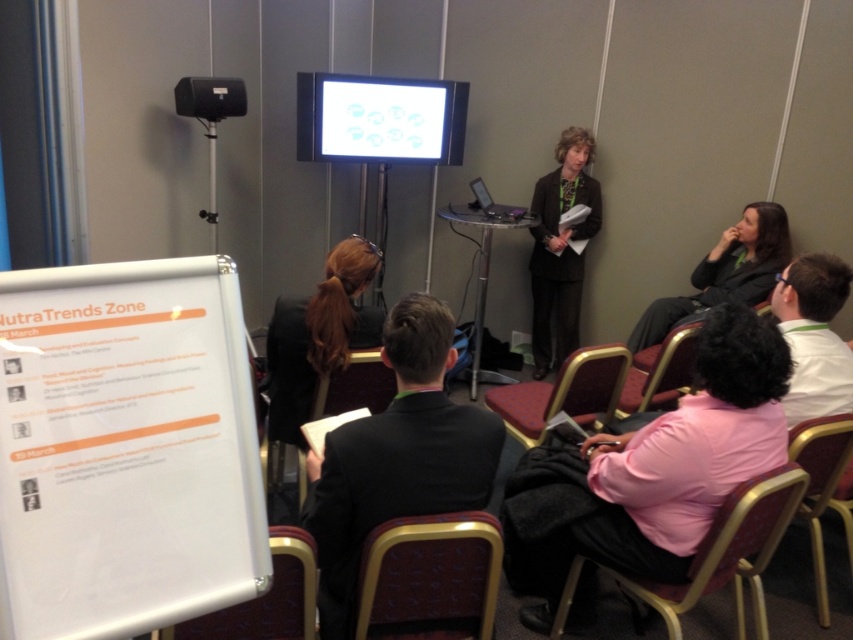
You are standing in the conference room and want to move from the point at coordinates (x=331, y=477) to the point at coordinates (x=706, y=260). Which direction should you move to get closer to the second point?

You should move backward because point (x=331, y=477) is closer to the camera than point (x=706, y=260). Moving backward will bring you closer to the point at (x=706, y=260).